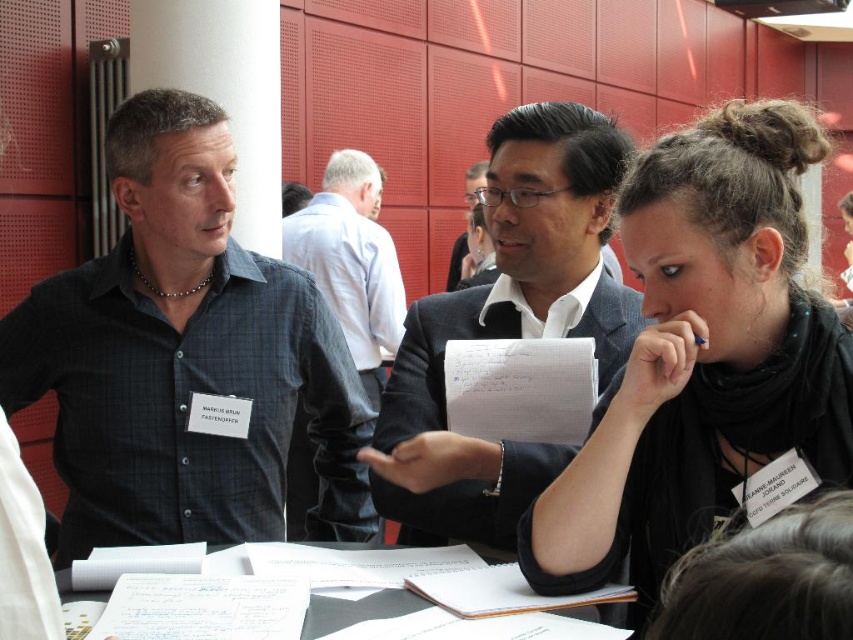
Does black matte hair at center have a larger size compared to dark gray suit at center?

No.

Can you confirm if black matte hair at center is positioned to the left of dark gray suit at center?

No, black matte hair at center is not to the left of dark gray suit at center.

This screenshot has width=853, height=640. What do you see at coordinates (701, 356) in the screenshot?
I see `black matte hair at center` at bounding box center [701, 356].

Find the location of a particular element. black matte hair at center is located at coordinates (701, 356).

Can you confirm if dark gray suit at center is bigger than matte black suit at center?

No.

Can you confirm if dark gray suit at center is taller than matte black suit at center?

Correct, dark gray suit at center is much taller as matte black suit at center.

The image size is (853, 640). In order to click on dark gray suit at center in this screenshot , I will do `click(508, 326)`.

Between white shirt at center and matte black suit at center, which one appears on the left side from the viewer's perspective?

white shirt at center

Who is higher up, white shirt at center or matte black suit at center?

matte black suit at center is above.

Between point (379, 177) and point (480, 173), which one is positioned behind?

The point (480, 173) is behind.

At what (x,y) coordinates should I click in order to perform the action: click on white shirt at center. Please return your answer as a coordinate pair (x, y). This screenshot has width=853, height=640. Looking at the image, I should click on (351, 260).